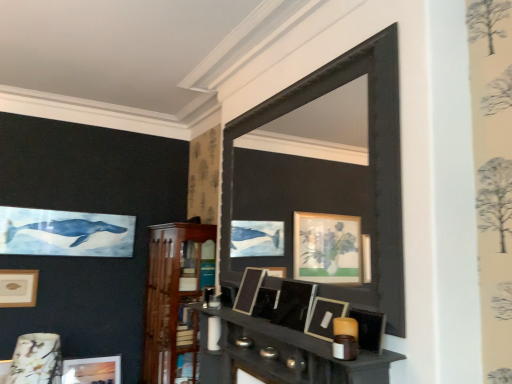
Describe the element at coordinates (175, 299) in the screenshot. I see `wooden shelf at center, arranged as the 1th shelf when viewed from the left` at that location.

At what (x,y) coordinates should I click in order to perform the action: click on matte black picture frame at center, which appears as the 4th picture frame when ordered from the bottom. Please return your answer as a coordinate pair (x, y). This screenshot has width=512, height=384. Looking at the image, I should click on (249, 290).

Measure the distance between matte wooden picture frame at lower left, the second picture frame viewed from the left, and camera.

The distance of matte wooden picture frame at lower left, the second picture frame viewed from the left, from camera is 3.01 meters.

Measure the distance between matte black picture frame at center, the 1th picture frame from the top, and camera.

A distance of 6.52 feet exists between matte black picture frame at center, the 1th picture frame from the top, and camera.

Locate an element on the screen. The width and height of the screenshot is (512, 384). porcelain floral-patterned lampshade at lower left is located at coordinates (36, 359).

Consider the image. Which of these two, matte wooden picture frame at lower left, the first picture frame in the bottom-to-top sequence, or porcelain floral-patterned lampshade at lower left, is smaller?

With smaller size is matte wooden picture frame at lower left, the first picture frame in the bottom-to-top sequence.

From the picture: Is matte wooden picture frame at lower left, the first picture frame in the bottom-to-top sequence, completely or partially outside of porcelain floral-patterned lampshade at lower left?

Yes.

Can you confirm if matte wooden picture frame at lower left, which is the 4th picture frame in right-to-left order, is positioned to the left of porcelain floral-patterned lampshade at lower left?

Correct, you'll find matte wooden picture frame at lower left, which is the 4th picture frame in right-to-left order, to the left of porcelain floral-patterned lampshade at lower left.

Is matte wooden picture frame at lower left, the first picture frame in the bottom-to-top sequence, in front of porcelain floral-patterned lampshade at lower left?

That is False.

Is black matte mirror at center further to the viewer compared to matte black picture frame at center, the third picture frame viewed from the right?

That is False.

From the picture: Considering the relative sizes of black matte mirror at center and matte black picture frame at center, which is the 3th picture frame in front-to-back order, in the image provided, is black matte mirror at center thinner than matte black picture frame at center, which is the 3th picture frame in front-to-back order,?

Indeed, black matte mirror at center has a lesser width compared to matte black picture frame at center, which is the 3th picture frame in front-to-back order.

What's the angular difference between black matte mirror at center and matte black picture frame at center, which appears as the 4th picture frame when ordered from the bottom,'s facing directions?

There is a 0.572-degree angle between the facing directions of black matte mirror at center and matte black picture frame at center, which appears as the 4th picture frame when ordered from the bottom.

From a real-world perspective, is black matte mirror at center above or below matte black picture frame at center, which appears as the second picture frame when viewed from the top?

In terms of real-world spatial position, black matte mirror at center is above matte black picture frame at center, which appears as the second picture frame when viewed from the top.

Can you tell me how much wooden shelf at center, arranged as the first shelf when viewed from the back, and matte black picture frame at center, arranged as the fourth picture frame when viewed from the left, differ in facing direction?

The angular difference between wooden shelf at center, arranged as the first shelf when viewed from the back, and matte black picture frame at center, arranged as the fourth picture frame when viewed from the left, is 0.651 degrees.

From the image's perspective, is wooden shelf at center, the 2th shelf from the front, located beneath matte black picture frame at center, arranged as the 3th picture frame when viewed from the top?

Yes, from the image's perspective, wooden shelf at center, the 2th shelf from the front, is beneath matte black picture frame at center, arranged as the 3th picture frame when viewed from the top.

Which object is further away from the camera, wooden shelf at center, arranged as the first shelf when viewed from the back, or matte black picture frame at center, which is the second picture frame from right to left?

Positioned behind is wooden shelf at center, arranged as the first shelf when viewed from the back.

Can you confirm if wooden shelf at center, the second shelf in the right-to-left sequence, is thinner than matte black picture frame at center, the 3th picture frame from the bottom?

No.

Are matte black picture frame at center, which is the first picture frame from front to back, and matte gold picture frame at upper left, placed as the fourth picture frame when sorted from front to back, far apart?

Yes, matte black picture frame at center, which is the first picture frame from front to back, and matte gold picture frame at upper left, placed as the fourth picture frame when sorted from front to back, are quite far apart.

Is matte gold picture frame at upper left, arranged as the 5th picture frame when viewed from the right, surrounded by matte black picture frame at center, which is counted as the fifth picture frame, starting from the left?

No, matte gold picture frame at upper left, arranged as the 5th picture frame when viewed from the right, is not a part of matte black picture frame at center, which is counted as the fifth picture frame, starting from the left.

Based on the photo, is matte black picture frame at center, the 1th picture frame from the top, looking in the opposite direction of matte gold picture frame at upper left, arranged as the 1th picture frame when viewed from the left?

No.

Is matte black picture frame at center, arranged as the 3th picture frame when viewed from the left, facing towards wooden shelf at center, the 2th shelf from the front?

No, matte black picture frame at center, arranged as the 3th picture frame when viewed from the left, is not aimed at wooden shelf at center, the 2th shelf from the front.

From a real-world perspective, which is physically above, matte black picture frame at center, the third picture frame viewed from the right, or wooden shelf at center, arranged as the first shelf when viewed from the back?

In real-world perspective, matte black picture frame at center, the third picture frame viewed from the right, is above.

Which is in front, point (257, 282) or point (176, 327)?

The point (257, 282) is more forward.

Who is taller, matte black picture frame at center, arranged as the 3th picture frame when viewed from the left, or wooden shelf at center, the 2th shelf from the front?

wooden shelf at center, the 2th shelf from the front.

Where is `shelf in front of the wooden shelf at center, the 2th shelf from the front`? The image size is (512, 384). shelf in front of the wooden shelf at center, the 2th shelf from the front is located at coordinates (x=282, y=354).

Considering the sizes of objects matte black shelf at center, acting as the 2th shelf starting from the left, and wooden shelf at center, arranged as the 1th shelf when viewed from the left, in the image provided, who is shorter, matte black shelf at center, acting as the 2th shelf starting from the left, or wooden shelf at center, arranged as the 1th shelf when viewed from the left,?

With less height is matte black shelf at center, acting as the 2th shelf starting from the left.

Based on the photo, are matte black shelf at center, placed as the second shelf when sorted from back to front, and wooden shelf at center, the second shelf in the right-to-left sequence, beside each other?

No, matte black shelf at center, placed as the second shelf when sorted from back to front, is not beside wooden shelf at center, the second shelf in the right-to-left sequence.

Which is more to the left, matte black shelf at center, placed as the second shelf when sorted from back to front, or wooden shelf at center, the second shelf in the right-to-left sequence?

wooden shelf at center, the second shelf in the right-to-left sequence.

Is wooden shelf at center, arranged as the 1th shelf when viewed from the left, thinner than matte black shelf at center, acting as the 2th shelf starting from the left?

No, wooden shelf at center, arranged as the 1th shelf when viewed from the left, is not thinner than matte black shelf at center, acting as the 2th shelf starting from the left.

Can you confirm if wooden shelf at center, the second shelf in the right-to-left sequence, is positioned to the left of matte black shelf at center, acting as the 2th shelf starting from the left?

Indeed, wooden shelf at center, the second shelf in the right-to-left sequence, is positioned on the left side of matte black shelf at center, acting as the 2th shelf starting from the left.

Is matte black shelf at center, the first shelf in the front-to-back sequence, at the back of wooden shelf at center, the 2th shelf from the front?

No.

Can you confirm if wooden shelf at center, the 2th shelf from the front, is smaller than matte black shelf at center, placed as the 1th shelf when sorted from right to left?

Incorrect, wooden shelf at center, the 2th shelf from the front, is not smaller in size than matte black shelf at center, placed as the 1th shelf when sorted from right to left.

This screenshot has width=512, height=384. I want to click on the 2nd picture frame behind the porcelain floral-patterned lampshade at lower left, starting your count from the anchor, so click(92, 370).

You are a GUI agent. You are given a task and a screenshot of the screen. Output one action in this format:
    pyautogui.click(x=<x>, y=<y>)
    Task: Click on the archway that appears above the matte black picture frame at center, which ranks as the 3th picture frame in back-to-front order (from the image's perspective)
    This screenshot has width=512, height=384.
    Given the screenshot: What is the action you would take?
    pyautogui.click(x=369, y=155)

When comparing their distances from matte black picture frame at center, which appears as the second picture frame when viewed from the top, does matte black shelf at center, the first shelf in the front-to-back sequence, or porcelain floral-patterned lampshade at lower left seem further?

porcelain floral-patterned lampshade at lower left.

Looking at the image, which one is located closer to porcelain floral-patterned lampshade at lower left, matte black picture frame at center, which is counted as the 5th picture frame, starting from the bottom, or matte wooden picture frame at lower left, which is counted as the fifth picture frame, starting from the front?

The object closer to porcelain floral-patterned lampshade at lower left is matte wooden picture frame at lower left, which is counted as the fifth picture frame, starting from the front.

Considering their positions, is matte black shelf at center, acting as the 2th shelf starting from the left, positioned closer to matte black picture frame at center, which is the second picture frame from right to left, than porcelain floral-patterned lampshade at lower left?

matte black shelf at center, acting as the 2th shelf starting from the left, lies closer to matte black picture frame at center, which is the second picture frame from right to left, than the other object.

Estimate the real-world distances between objects in this image. Which object is further from matte wooden picture frame at lower left, which ranks as the 5th picture frame in top-to-bottom order, matte black picture frame at center, which is counted as the fifth picture frame, starting from the left, or black matte mirror at center?

matte black picture frame at center, which is counted as the fifth picture frame, starting from the left, lies further to matte wooden picture frame at lower left, which ranks as the 5th picture frame in top-to-bottom order, than the other object.

Estimate the real-world distances between objects in this image. Which object is closer to matte wooden picture frame at lower left, the second picture frame viewed from the left, porcelain floral-patterned lampshade at lower left or wooden shelf at center, arranged as the 1th shelf when viewed from the left?

porcelain floral-patterned lampshade at lower left is positioned closer to the anchor matte wooden picture frame at lower left, the second picture frame viewed from the left.

From the picture: Based on their spatial positions, is porcelain floral-patterned lampshade at lower left or matte black picture frame at center, which is the second picture frame from front to back, further from black matte mirror at center?

porcelain floral-patterned lampshade at lower left is positioned further to the anchor black matte mirror at center.

Looking at the image, which one is located closer to black matte mirror at center, matte black picture frame at center, the 1th picture frame from the top, or matte wooden picture frame at lower left, which is counted as the fifth picture frame, starting from the front?

The object closer to black matte mirror at center is matte black picture frame at center, the 1th picture frame from the top.

Which object lies further to the anchor point wooden shelf at center, arranged as the 1th shelf when viewed from the left, matte wooden picture frame at lower left, which is counted as the fifth picture frame, starting from the front, or matte black picture frame at center, arranged as the 3th picture frame when viewed from the left?

matte black picture frame at center, arranged as the 3th picture frame when viewed from the left, lies further to wooden shelf at center, arranged as the 1th shelf when viewed from the left, than the other object.

The image size is (512, 384). In order to click on lamp located between matte gold picture frame at upper left, placed as the fourth picture frame when sorted from front to back, and wooden shelf at center, arranged as the first shelf when viewed from the back, in the left-right direction in this screenshot , I will do `click(36, 359)`.

The width and height of the screenshot is (512, 384). Identify the location of shelf between matte gold picture frame at upper left, arranged as the 5th picture frame when viewed from the right, and matte black picture frame at center, the 4th picture frame in the back-to-front sequence, in the horizontal direction. (175, 299).

Identify the location of archway located between porcelain floral-patterned lampshade at lower left and matte black picture frame at center, the 1th picture frame from the top, in the left-right direction. (369, 155).

The width and height of the screenshot is (512, 384). In order to click on shelf positioned between matte black shelf at center, the first shelf in the front-to-back sequence, and matte wooden picture frame at lower left, which is counted as the fifth picture frame, starting from the front, from near to far in this screenshot , I will do `click(175, 299)`.